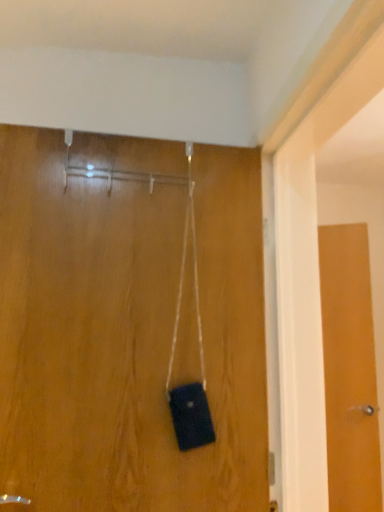
Question: From a real-world perspective, is matte wood door at center, which is the first door from front to back, physically located above or below wooden door at right, the 2th door from the left?

Choices:
 (A) below
 (B) above

Answer: (B)

Question: Considering the positions of matte wood door at center, positioned as the first door in left-to-right order, and wooden door at right, the 2th door from the front, in the image, is matte wood door at center, positioned as the first door in left-to-right order, wider or thinner than wooden door at right, the 2th door from the front,?

Choices:
 (A) wide
 (B) thin

Answer: (A)

Question: Looking at the image, does matte wood door at center, which is the first door from front to back, seem bigger or smaller compared to wooden door at right, which appears as the first door when viewed from the back?

Choices:
 (A) big
 (B) small

Answer: (A)

Question: From the image's perspective, is wooden door at right, the 2th door from the left, positioned above or below matte wood door at center, which is the first door from front to back?

Choices:
 (A) above
 (B) below

Answer: (B)

Question: From a real-world perspective, is wooden door at right, the 2th door from the front, positioned above or below matte wood door at center, which is the first door from front to back?

Choices:
 (A) below
 (B) above

Answer: (A)

Question: Visually, is wooden door at right, which appears as the first door when viewed from the back, positioned to the left or to the right of matte wood door at center, positioned as the first door in left-to-right order?

Choices:
 (A) left
 (B) right

Answer: (B)

Question: In terms of height, does wooden door at right, which appears as the first door when viewed from the back, look taller or shorter compared to matte wood door at center, which is the first door from front to back?

Choices:
 (A) short
 (B) tall

Answer: (B)